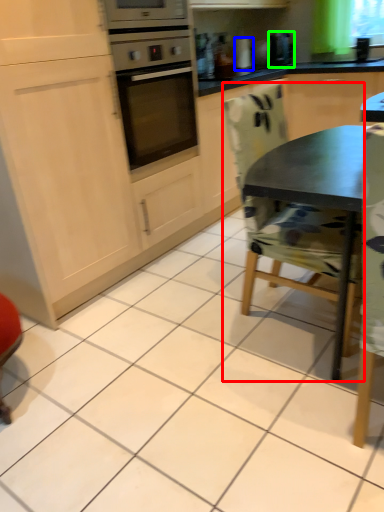
Question: Which object is positioned closest to chair (highlighted by a red box)? Select from appliance (highlighted by a blue box) and coffee machine (highlighted by a green box).

Choices:
 (A) appliance
 (B) coffee machine

Answer: (B)